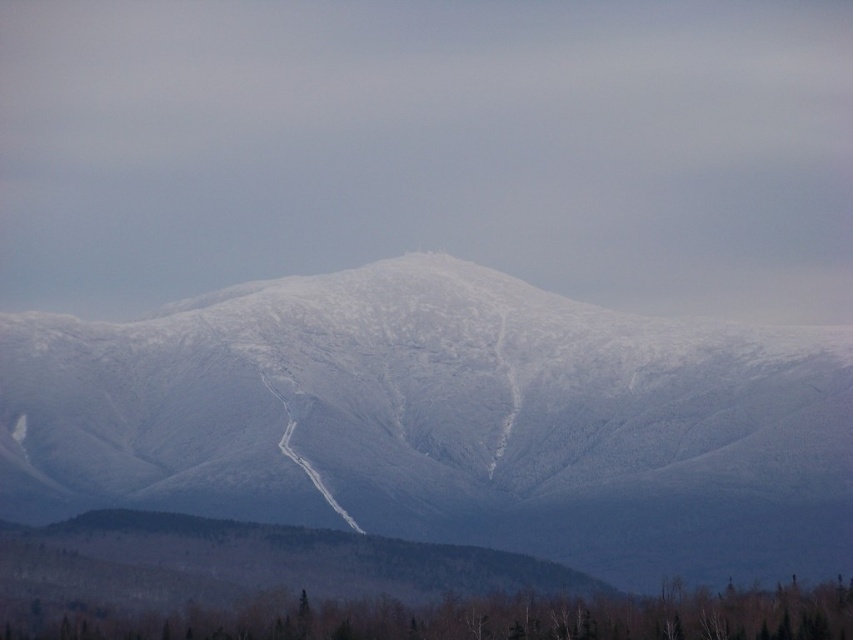
This screenshot has width=853, height=640. Find the location of `white snow-covered mountain at center`. white snow-covered mountain at center is located at coordinates (445, 420).

How far apart are white snow-covered mountain at center and green matte tree at lower center?

white snow-covered mountain at center is 35.94 meters away from green matte tree at lower center.

You are a GUI agent. You are given a task and a screenshot of the screen. Output one action in this format:
    pyautogui.click(x=<x>, y=<y>)
    Task: Click on the white snow-covered mountain at center
    The width and height of the screenshot is (853, 640).
    Given the screenshot: What is the action you would take?
    pyautogui.click(x=445, y=420)